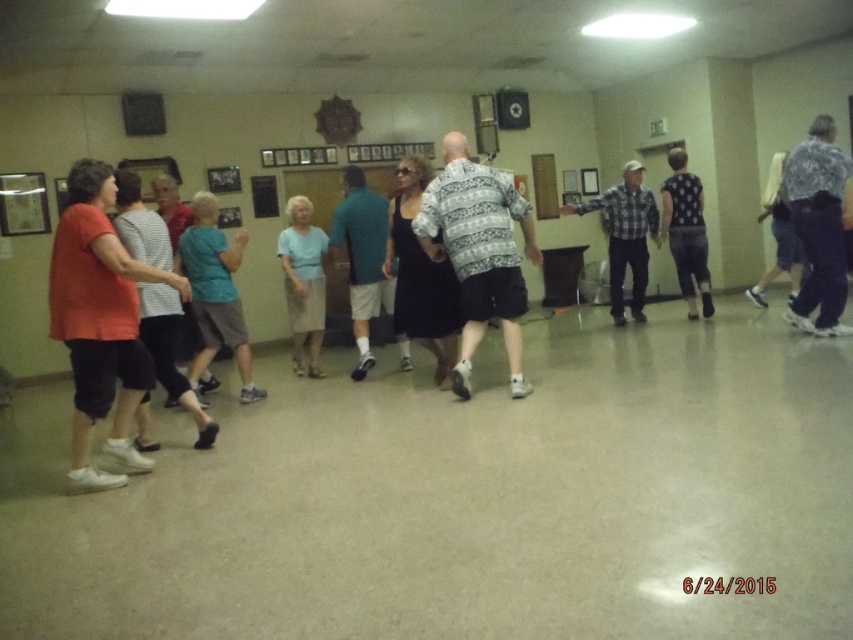
Question: Which point appears farthest from the camera in this image?

Choices:
 (A) (335, 224)
 (B) (195, 385)
 (C) (706, 260)

Answer: (C)

Question: Is patterned shirt at center to the right of light blue fabric skirt at center from the viewer's perspective?

Choices:
 (A) yes
 (B) no

Answer: (A)

Question: Which point appears closest to the camera in this image?

Choices:
 (A) (456, 173)
 (B) (672, 186)
 (C) (637, 280)
 (D) (357, 221)

Answer: (A)

Question: Which is farther from the teal fabric shirt at center?

Choices:
 (A) matte red shirt at left
 (B) floral shirt at center

Answer: (B)

Question: Is plaid cotton shirt at center to the right of black dotted blouse at center from the viewer's perspective?

Choices:
 (A) yes
 (B) no

Answer: (B)

Question: Can you confirm if floral shirt at center is bigger than plaid cotton shirt at center?

Choices:
 (A) yes
 (B) no

Answer: (B)